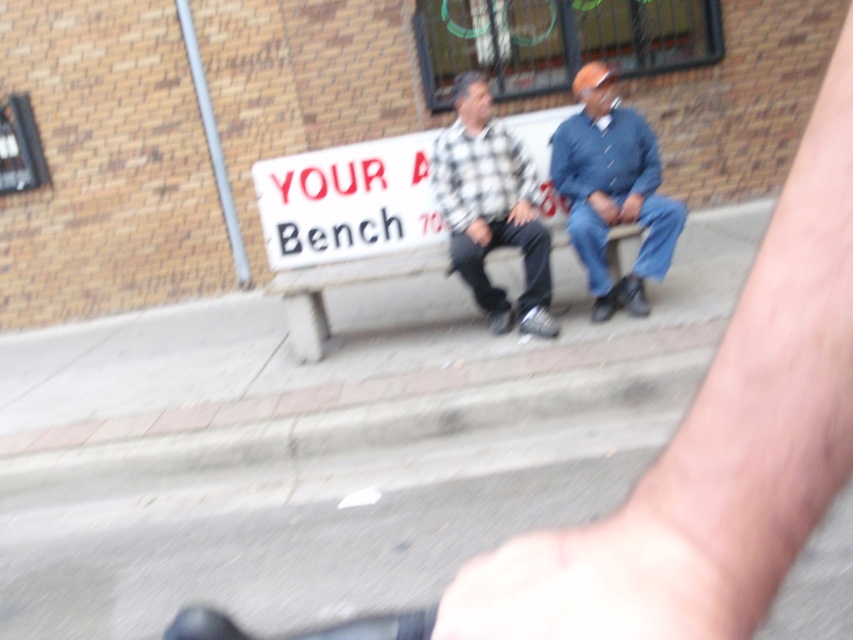
You are a delivery person who needs to attach a package to the white plastic sign at center and the concrete bench at center. Which object can you attach the package to if the package requires a surface larger than the sign?

The concrete bench at center has a larger size than the white plastic sign at center, so you can attach the package to the concrete bench at center.

In the scene shown: You are designing a poster for a community event and need to know the relative sizes of the objects in the image. Which object is smaller in size between the white plastic sign at center and the blue denim jeans at center?

The white plastic sign at center is smaller in size compared to the blue denim jeans at center.

You are a city planner reviewing this public space. The white plastic sign at center and the concrete bench at center are both in the same area. Which object is taller?

The white plastic sign at center is much taller than the concrete bench at center.